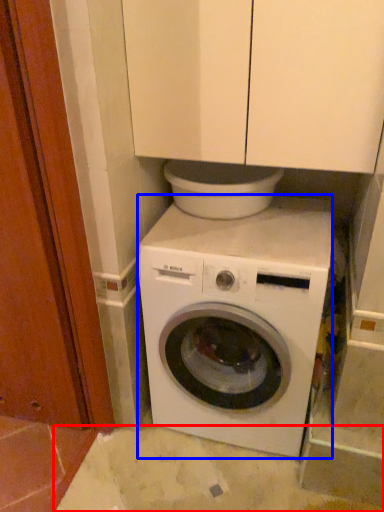
Question: Which point is further to the camera, concrete (highlighted by a red box) or washing machine (highlighted by a blue box)?

Choices:
 (A) concrete
 (B) washing machine

Answer: (A)